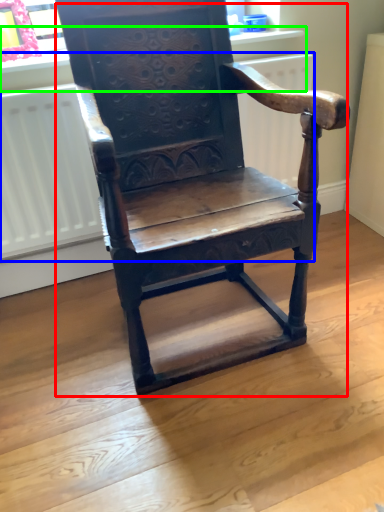
Question: Based on their relative distances, which object is farther from chair (highlighted by a red box)? Choose from radiator (highlighted by a blue box) and window sill (highlighted by a green box).

Choices:
 (A) radiator
 (B) window sill

Answer: (B)